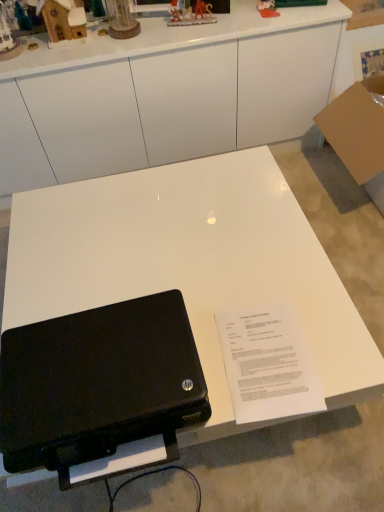
Where is `free spot behind black matte laptop at lower left`? free spot behind black matte laptop at lower left is located at coordinates (118, 271).